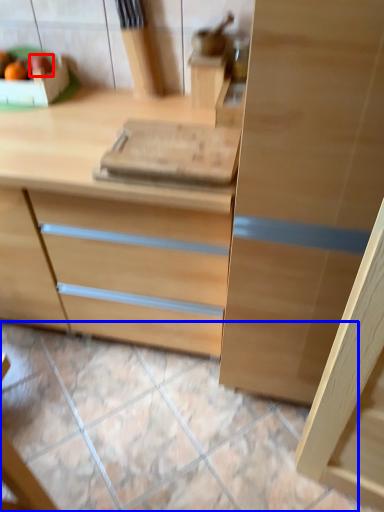
Question: Which of the following is the farthest to the observer, fruit (highlighted by a red box) or tile (highlighted by a blue box)?

Choices:
 (A) fruit
 (B) tile

Answer: (A)